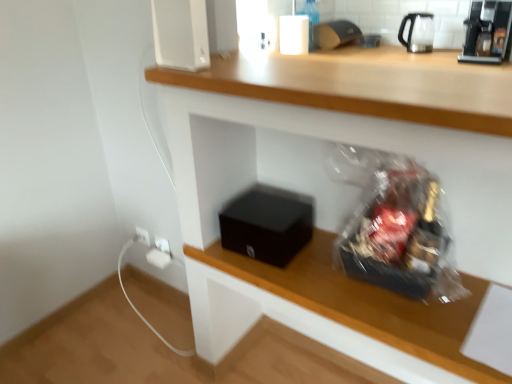
Question: Considering the relative sizes of white plastic electric outlet at lower left and black plastic coffee machine at upper right in the image provided, is white plastic electric outlet at lower left thinner than black plastic coffee machine at upper right?

Choices:
 (A) yes
 (B) no

Answer: (A)

Question: Would you say black plastic coffee machine at upper right is part of white plastic electric outlet at lower left's contents?

Choices:
 (A) yes
 (B) no

Answer: (B)

Question: Is white plastic electric outlet at lower left outside of black plastic coffee machine at upper right?

Choices:
 (A) no
 (B) yes

Answer: (B)

Question: From a real-world perspective, is white plastic electric outlet at lower left below black plastic coffee machine at upper right?

Choices:
 (A) yes
 (B) no

Answer: (A)

Question: Does white plastic electric outlet at lower left have a larger size compared to black plastic coffee machine at upper right?

Choices:
 (A) yes
 (B) no

Answer: (B)

Question: Does white plastic electric outlet at lower left have a lesser height compared to black plastic coffee machine at upper right?

Choices:
 (A) yes
 (B) no

Answer: (A)

Question: From the image's perspective, is clear glass bottle at upper center on top of transparent glass tea pot at upper right?

Choices:
 (A) no
 (B) yes

Answer: (B)

Question: Does clear glass bottle at upper center lie behind transparent glass tea pot at upper right?

Choices:
 (A) no
 (B) yes

Answer: (B)

Question: Is clear glass bottle at upper center oriented away from transparent glass tea pot at upper right?

Choices:
 (A) yes
 (B) no

Answer: (B)

Question: Could you tell me if clear glass bottle at upper center is facing transparent glass tea pot at upper right?

Choices:
 (A) yes
 (B) no

Answer: (B)

Question: Does clear glass bottle at upper center have a greater width compared to transparent glass tea pot at upper right?

Choices:
 (A) no
 (B) yes

Answer: (A)

Question: From the image's perspective, is clear glass bottle at upper center under transparent glass tea pot at upper right?

Choices:
 (A) no
 (B) yes

Answer: (A)

Question: Would you say black matte box at lower center contains transparent glass tea pot at upper right?

Choices:
 (A) yes
 (B) no

Answer: (B)